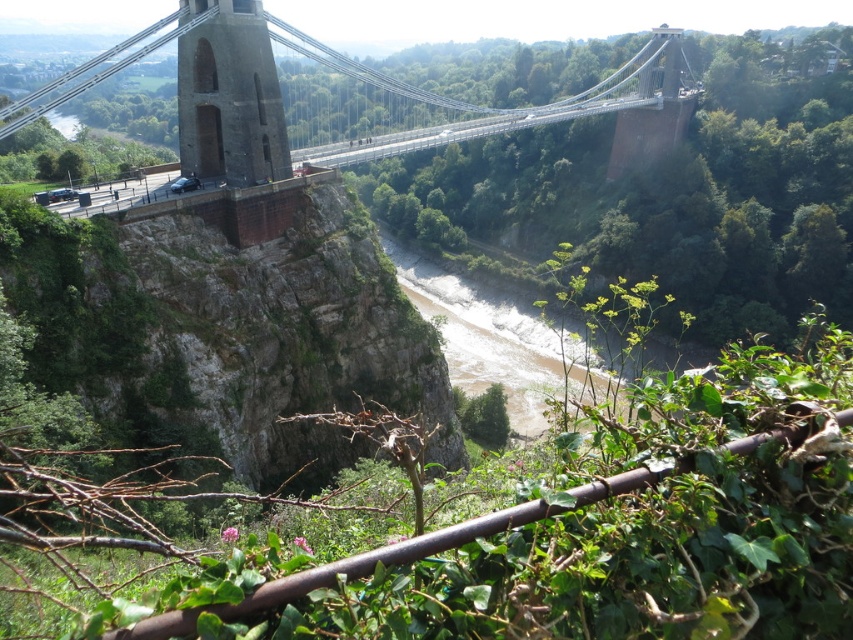
You are standing on the concrete bridge at center and want to cross to the other side. Can you see the dark gray stone tower at center from your current position on the bridge?

Yes, because the concrete bridge at center is located above the dark gray stone tower at center, so the tower is visible from the bridge.

You are a hiker standing on the concrete bridge at center. You want to cross the river below. Is the brown sandy river at center directly underneath you?

Yes, the concrete bridge at center is located above the brown sandy river at center, so the river is directly underneath you.

You are standing on the suspension bridge and want to take a photo. You notice two points marked on the bridge deck. The first point is at coordinates point (669, 42) and the second is at point (268, 90). Which point is closer to the camera when taking the photo?

Point (268, 90) is closer to the camera because it is less further than point (669, 42).